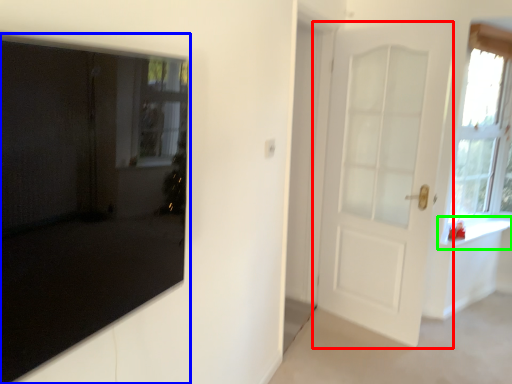
Question: Estimate the real-world distances between objects in this image. Which object is farther from door (highlighted by a red box), door (highlighted by a blue box) or window sill (highlighted by a green box)?

Choices:
 (A) door
 (B) window sill

Answer: (A)